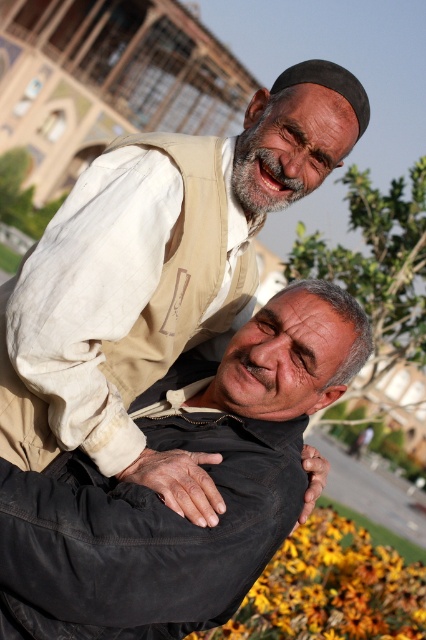
Question: Does beige fabric sleeve at upper left appear on the right side of yellow matte flower at lower center?

Choices:
 (A) no
 (B) yes

Answer: (A)

Question: Is beige fabric sleeve at upper left behind yellow matte flower at lower center?

Choices:
 (A) no
 (B) yes

Answer: (A)

Question: Which point is farther from the camera taking this photo?

Choices:
 (A) (282, 589)
 (B) (60, 234)

Answer: (A)

Question: Is beige fabric sleeve at upper left behind yellow matte flower at lower center?

Choices:
 (A) no
 (B) yes

Answer: (A)